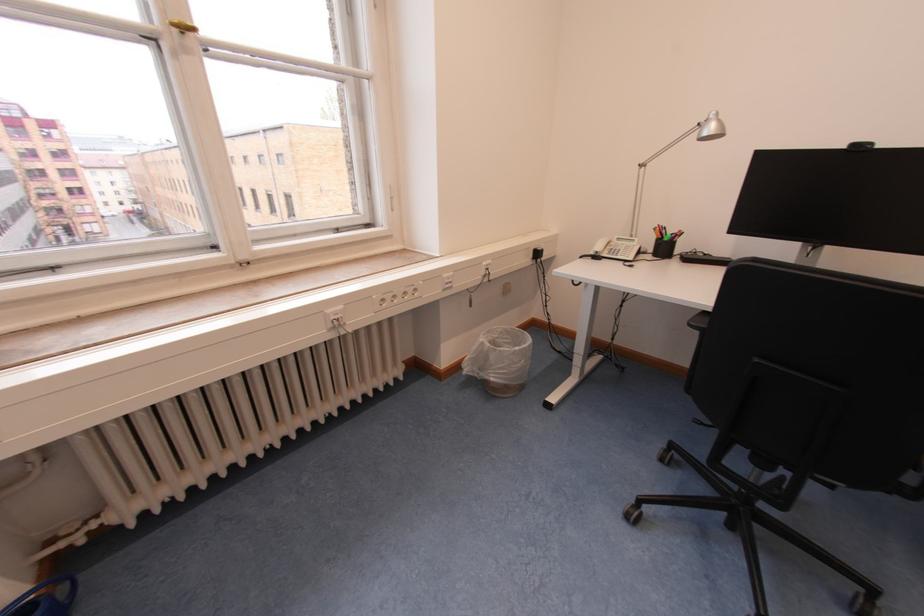
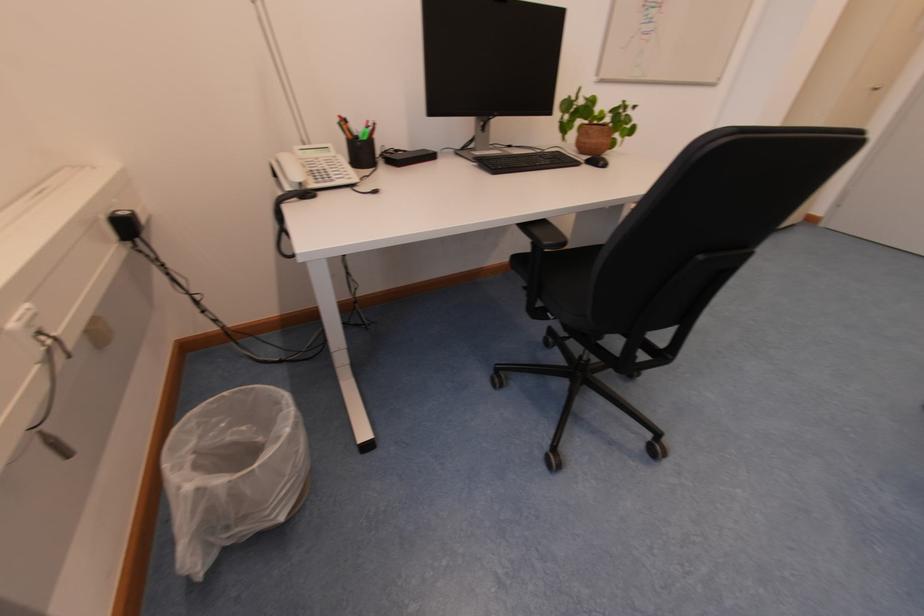
Where in the second image is the point corresponding to [599,256] from the first image?

(296, 191)